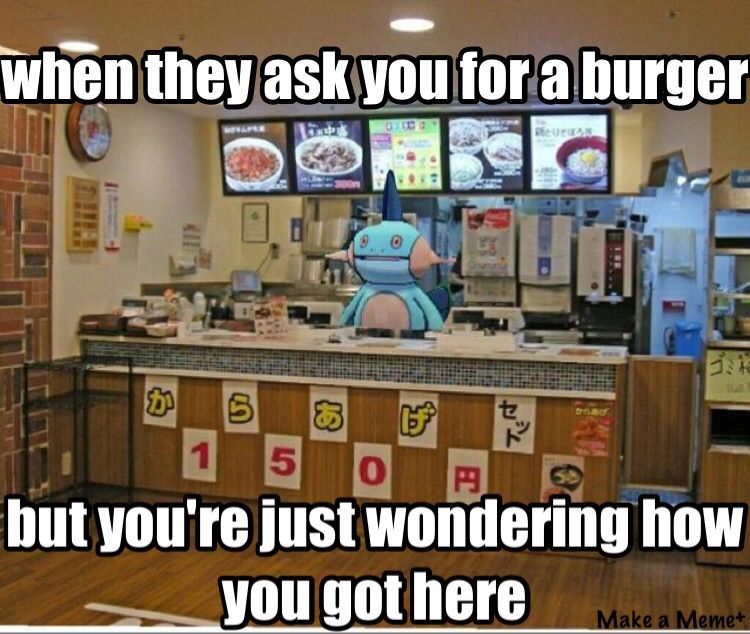
The height and width of the screenshot is (634, 750). Identify the location of floor. (91, 585).